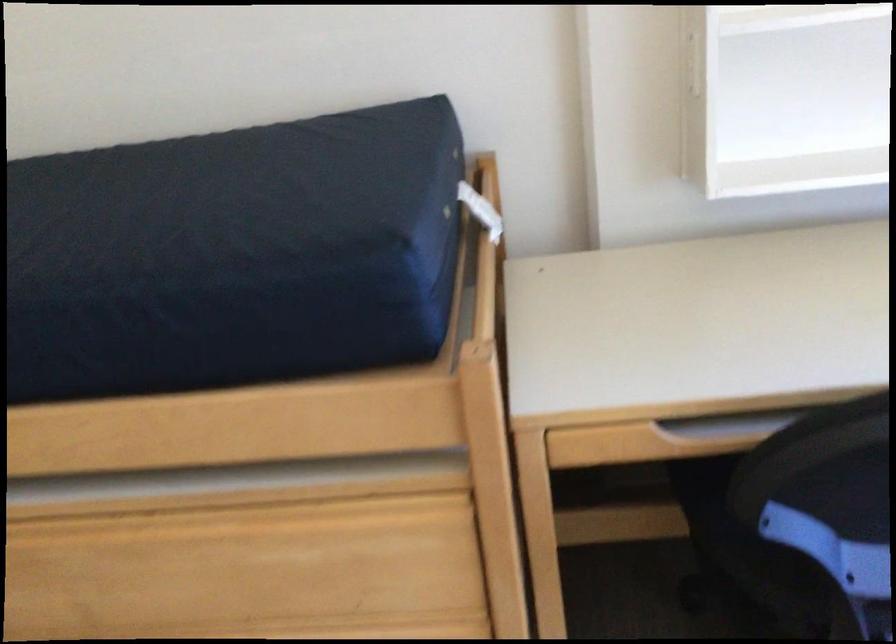
Where is `cabinet door handle`? The width and height of the screenshot is (896, 644). cabinet door handle is located at coordinates (693, 64).